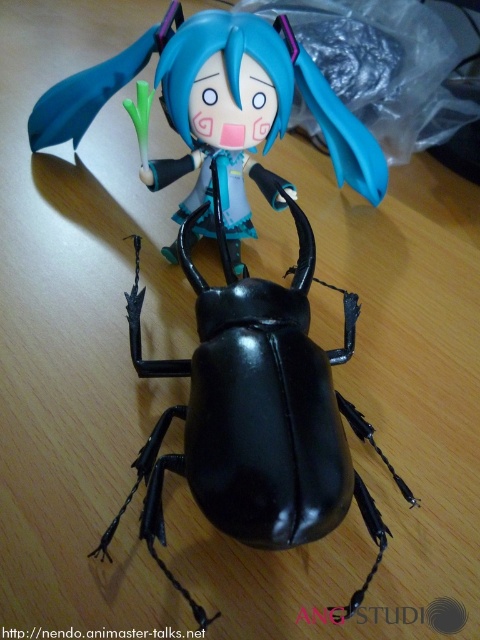
Where is `black glossy beetle at center`? The width and height of the screenshot is (480, 640). black glossy beetle at center is located at coordinates (255, 413).

Does point (357, 307) lie behind point (216, 19)?

That is True.

The image size is (480, 640). Find the location of `black glossy beetle at center`. black glossy beetle at center is located at coordinates (255, 413).